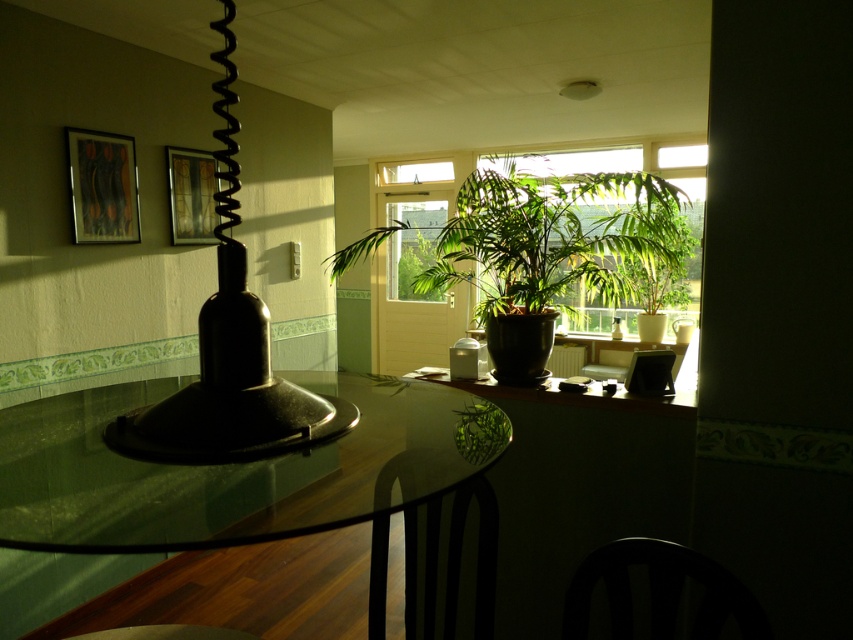
Is green glossy plant at center bigger than wooden picture frame at upper left?

Yes, green glossy plant at center is bigger than wooden picture frame at upper left.

Is green glossy plant at center further to the viewer compared to wooden picture frame at upper left?

No.

Find the location of a particular element. The image size is (853, 640). green glossy plant at center is located at coordinates (556, 237).

You are a GUI agent. You are given a task and a screenshot of the screen. Output one action in this format:
    pyautogui.click(x=<x>, y=<y>)
    Task: Click on the green glossy plant at center
    This screenshot has width=853, height=640.
    Given the screenshot: What is the action you would take?
    pyautogui.click(x=556, y=237)

Who is more forward, (451, 560) or (172, 227)?

Point (451, 560)

Who is shorter, black metal chair at lower center or wooden picture frame at upper left?

Standing shorter between the two is wooden picture frame at upper left.

Who is more forward, (438, 499) or (194, 176)?

Positioned in front is point (438, 499).

Find the location of a particular element. The height and width of the screenshot is (640, 853). black metal chair at lower center is located at coordinates (477, 556).

Who is positioned more to the left, matte black lampshade at left or wooden picture frame at upper left?

Positioned to the left is wooden picture frame at upper left.

Is matte black lampshade at left taller than wooden picture frame at upper left?

Correct, matte black lampshade at left is much taller as wooden picture frame at upper left.

Image resolution: width=853 pixels, height=640 pixels. Identify the location of matte black lampshade at left. (230, 349).